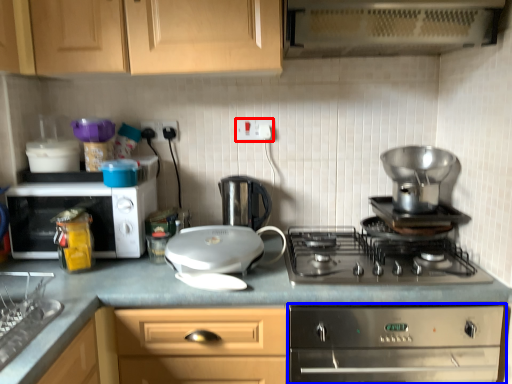
Question: Which object is further to the camera taking this photo, electric outlet (highlighted by a red box) or home appliance (highlighted by a blue box)?

Choices:
 (A) electric outlet
 (B) home appliance

Answer: (A)